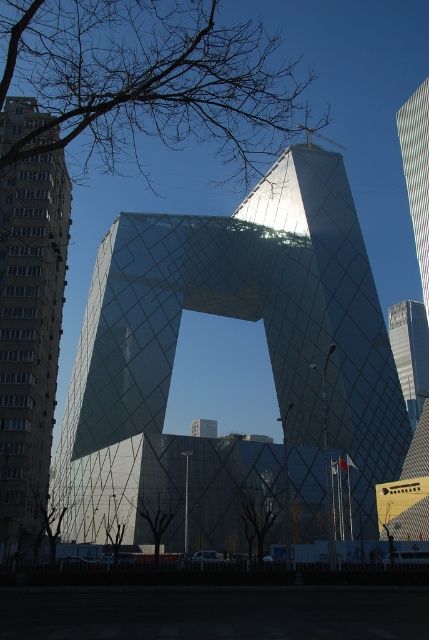
You are an architect evaluating the design of the reflective glass tower at center and the metallic glass skyscraper at upper right. Which of the two buildings has a greater width?

The reflective glass tower at center has a greater width than the metallic glass skyscraper at upper right.